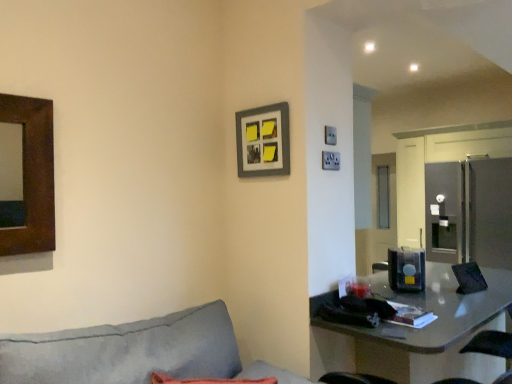
Question: Can matte gray picture frame at upper center be found inside translucent plastic container at center?

Choices:
 (A) no
 (B) yes

Answer: (A)

Question: Is translucent plastic container at center far away from matte gray picture frame at upper center?

Choices:
 (A) no
 (B) yes

Answer: (B)

Question: Is translucent plastic container at center looking in the opposite direction of matte gray picture frame at upper center?

Choices:
 (A) no
 (B) yes

Answer: (A)

Question: Is translucent plastic container at center smaller than matte gray picture frame at upper center?

Choices:
 (A) no
 (B) yes

Answer: (A)

Question: From a real-world perspective, is translucent plastic container at center under matte gray picture frame at upper center?

Choices:
 (A) no
 (B) yes

Answer: (B)

Question: Choose the correct answer: Is translucent plastic container at center inside matte gray table at lower right or outside it?

Choices:
 (A) inside
 (B) outside

Answer: (B)

Question: Is translucent plastic container at center wider or thinner than matte gray table at lower right?

Choices:
 (A) thin
 (B) wide

Answer: (A)

Question: From the image's perspective, is translucent plastic container at center positioned above or below matte gray table at lower right?

Choices:
 (A) above
 (B) below

Answer: (A)

Question: Is point (423, 284) positioned closer to the camera than point (352, 327)?

Choices:
 (A) farther
 (B) closer

Answer: (A)

Question: Considering the positions of point (452, 316) and point (403, 246), is point (452, 316) closer or farther from the camera than point (403, 246)?

Choices:
 (A) closer
 (B) farther

Answer: (A)

Question: Considering the positions of matte gray table at lower right and translucent plastic container at center in the image, is matte gray table at lower right wider or thinner than translucent plastic container at center?

Choices:
 (A) wide
 (B) thin

Answer: (A)

Question: Is matte gray table at lower right in front of or behind translucent plastic container at center in the image?

Choices:
 (A) behind
 (B) front

Answer: (B)

Question: Do you think matte gray table at lower right is within translucent plastic container at center, or outside of it?

Choices:
 (A) outside
 (B) inside

Answer: (A)

Question: Considering the positions of point [244, 162] and point [415, 281], is point [244, 162] closer or farther from the camera than point [415, 281]?

Choices:
 (A) closer
 (B) farther

Answer: (A)

Question: From the image's perspective, is matte gray picture frame at upper center located above or below translucent plastic container at center?

Choices:
 (A) below
 (B) above

Answer: (B)